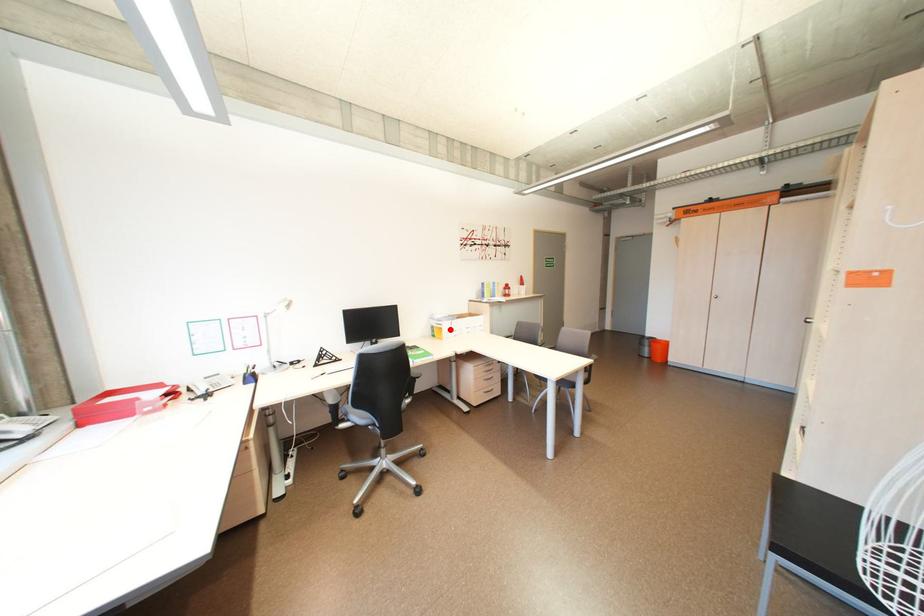
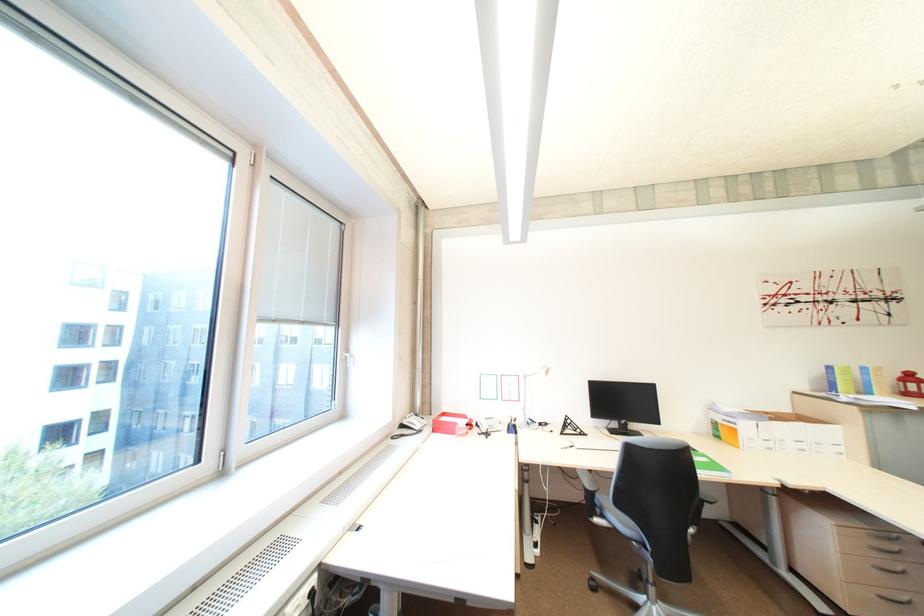
Question: I am providing you with two images of the same scene from different viewpoints. A red point is marked on the first image. At the location where the point appears in image 1, is it still visible in image 2?

Choices:
 (A) Yes
 (B) No

Answer: (A)